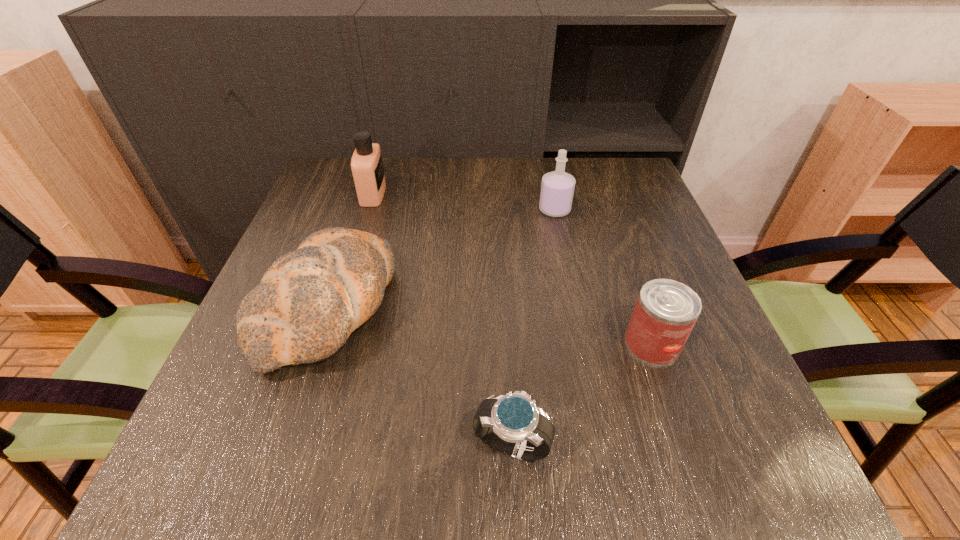
Identify which object is the second nearest to the watch. Please provide its 2D coordinates. Your answer should be formatted as a tuple, i.e. [(x, y)], where the tuple contains the x and y coordinates of a point satisfying the conditions above.

[(666, 311)]

Where is `the second closest object relative to the rightmost object`? The height and width of the screenshot is (540, 960). the second closest object relative to the rightmost object is located at coordinates (557, 188).

This screenshot has height=540, width=960. I want to click on vacant area in the image that satisfies the following two spatial constraints: 1. on the front label of the left perfume; 2. on the back side of the can, so click(x=326, y=344).

This screenshot has height=540, width=960. I want to click on vacant space that satisfies the following two spatial constraints: 1. on the front label of the left perfume; 2. on the left side of the can, so click(326, 344).

You are a GUI agent. You are given a task and a screenshot of the screen. Output one action in this format:
    pyautogui.click(x=<x>, y=<y>)
    Task: Click on the free space that satisfies the following two spatial constraints: 1. on the front label of the left perfume; 2. on the right side of the can
    The image size is (960, 540).
    Given the screenshot: What is the action you would take?
    pyautogui.click(x=326, y=344)

Locate an element on the screen. free spot that satisfies the following two spatial constraints: 1. on the back side of the rightmost object; 2. on the front label of the left perfume is located at coordinates (600, 194).

Identify the location of vacant space that satisfies the following two spatial constraints: 1. on the front label of the left perfume; 2. on the left side of the rightmost object. This screenshot has width=960, height=540. point(326,344).

In order to click on blank space that satisfies the following two spatial constraints: 1. on the front label of the left perfume; 2. on the back side of the second object from right to left in this screenshot , I will do `click(369, 210)`.